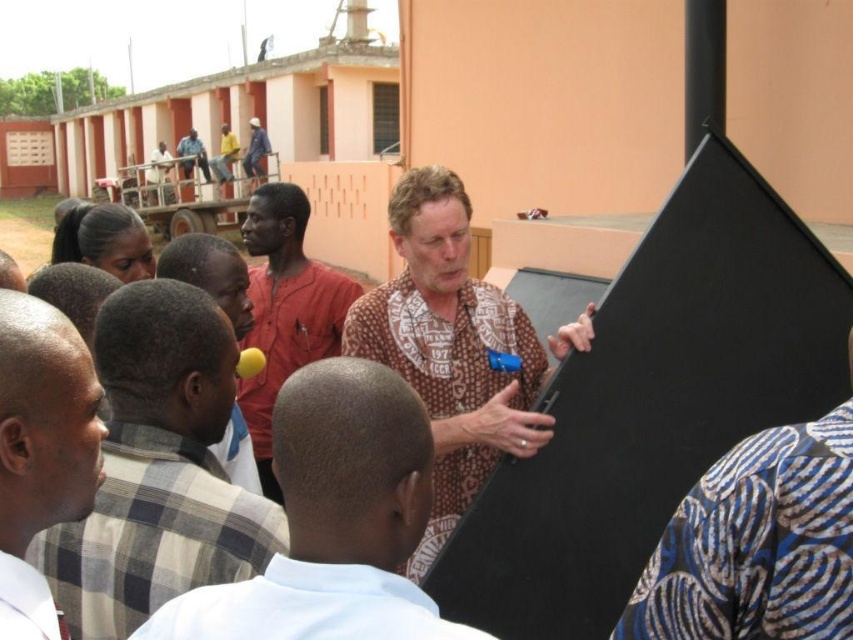
You are standing in the scene and see the point at coordinates (41, 451). What object or clothing item is this point located on?

The point at coordinates (41, 451) is located on the smooth black shirt at center.

You are a photographer trying to capture a closeup of the smooth black shirt at center without the light brown fabric shirt at center blocking it. Which shirt should you focus on first?

The smooth black shirt at center is positioned under the light brown fabric shirt at center, so you should focus on the light brown fabric shirt at center first to avoid blocking the smooth black shirt at center.

You are standing at the entrance of the building and want to approach the person wearing the brown printed shirt at center. Which direction should you walk to reach them?

The brown printed shirt at center is located at point (x=451, y=348), so you should walk towards the center of the image to reach them.